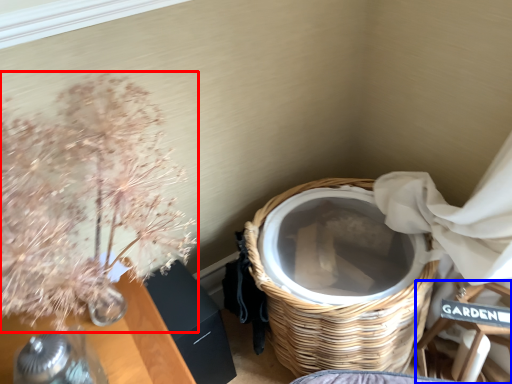
Question: Which object is further to the camera taking this photo, floral arrangement (highlighted by a red box) or armchair (highlighted by a blue box)?

Choices:
 (A) floral arrangement
 (B) armchair

Answer: (B)